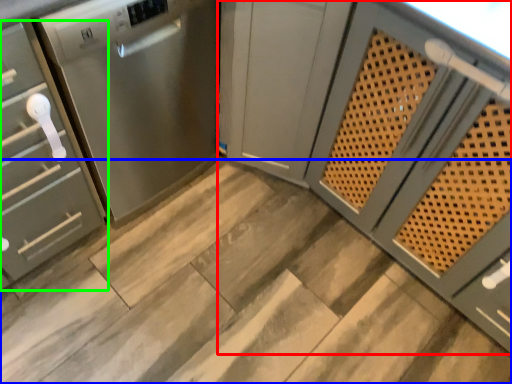
Question: Estimate the real-world distances between objects in this image. Which object is farther from cabinetry (highlighted by a red box), stair (highlighted by a blue box) or cabinetry (highlighted by a green box)?

Choices:
 (A) stair
 (B) cabinetry

Answer: (B)